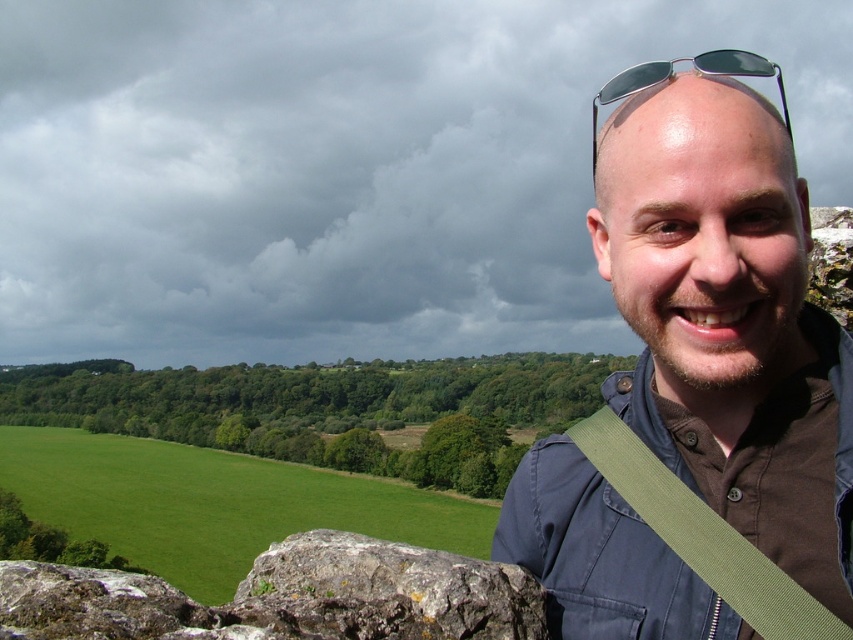
Question: Does green grass at left have a larger size compared to rough textured stone at lower left?

Choices:
 (A) yes
 (B) no

Answer: (A)

Question: Is brown fabric shirt at upper right bigger than green grass at left?

Choices:
 (A) no
 (B) yes

Answer: (A)

Question: Which of the following is the farthest from the observer?

Choices:
 (A) brown fabric shirt at upper right
 (B) green grass at left

Answer: (B)

Question: Is brown fabric shirt at upper right behind green fabric strap at right?

Choices:
 (A) no
 (B) yes

Answer: (A)

Question: Which point is closer to the camera?

Choices:
 (A) brown fabric shirt at upper right
 (B) green grass at left
 (C) rough textured stone at lower left

Answer: (A)

Question: Which point is closer to the camera?

Choices:
 (A) brown fabric shirt at upper right
 (B) sunglasses at upper center
 (C) rough textured stone at lower left

Answer: (A)